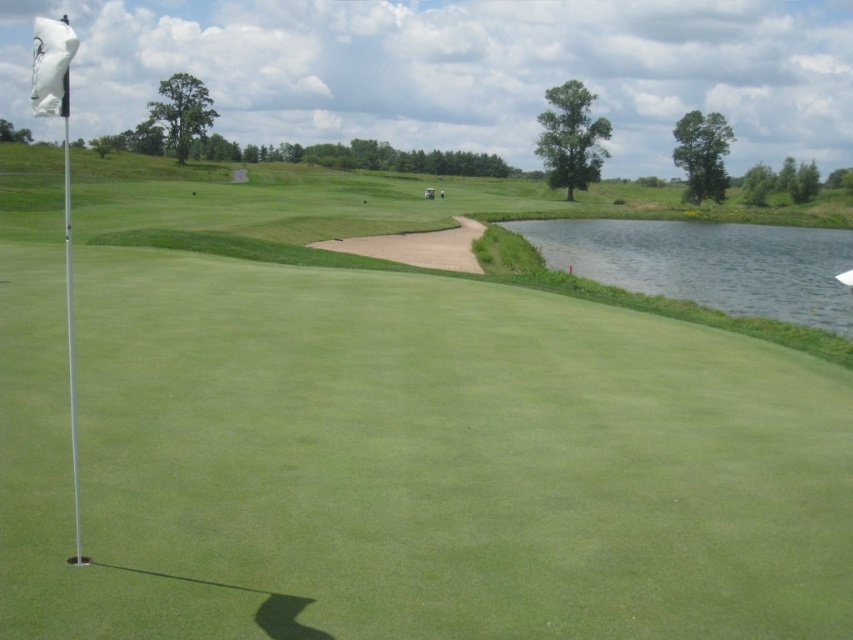
Question: Can you confirm if clear water at right is positioned to the left of white matte flag at upper left?

Choices:
 (A) yes
 (B) no

Answer: (B)

Question: Which object appears closest to the camera in this image?

Choices:
 (A) white matte flag at upper left
 (B) clear water at right

Answer: (A)

Question: Can you confirm if clear water at right is bigger than white matte flag at upper left?

Choices:
 (A) yes
 (B) no

Answer: (B)

Question: Among these points, which one is farthest from the camera?

Choices:
 (A) (65, 157)
 (B) (822, 243)

Answer: (A)

Question: Considering the relative positions of clear water at right and white matte flag at upper left in the image provided, where is clear water at right located with respect to white matte flag at upper left?

Choices:
 (A) left
 (B) right

Answer: (B)